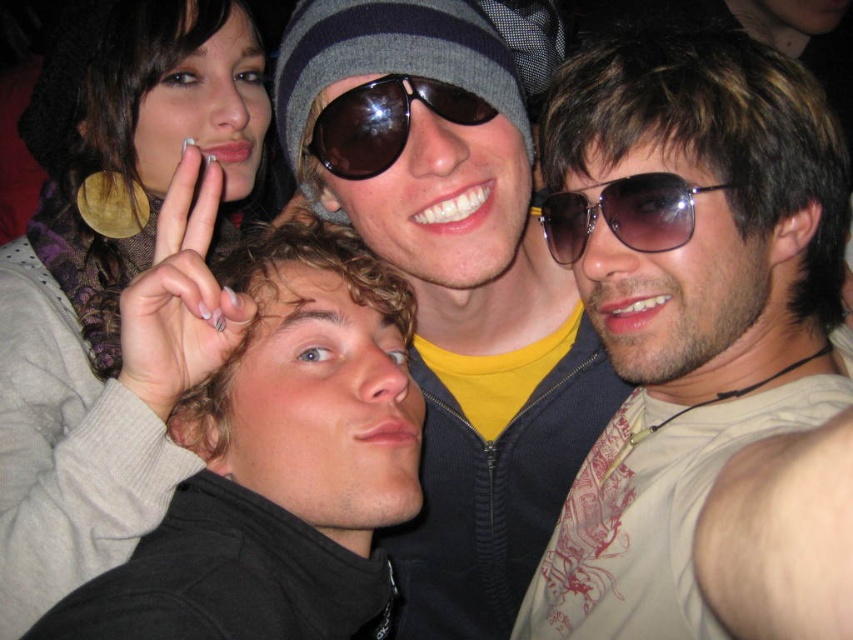
Question: Can you confirm if dark brown curly hair at center is smaller than metallic aviator sunglasses at center?

Choices:
 (A) yes
 (B) no

Answer: (B)

Question: Based on their relative distances, which object is farther from the dark brown curly hair at center?

Choices:
 (A) matte gold hoop earring at upper left
 (B) matte black jacket at center
 (C) metallic aviator sunglasses at center
 (D) shiny brown sunglasses at center

Answer: (C)

Question: Among these points, which one is nearest to the camera?

Choices:
 (A) (370, 131)
 (B) (102, 593)
 (C) (397, 560)

Answer: (B)

Question: Can you confirm if matte gray sunglasses at center is positioned to the left of matte gold hoop earring at upper left?

Choices:
 (A) yes
 (B) no

Answer: (B)

Question: Can you confirm if matte gray sunglasses at center is smaller than matte black jacket at center?

Choices:
 (A) no
 (B) yes

Answer: (B)

Question: Which of the following is the farthest from the observer?

Choices:
 (A) matte gray sunglasses at center
 (B) matte black jacket at center

Answer: (B)